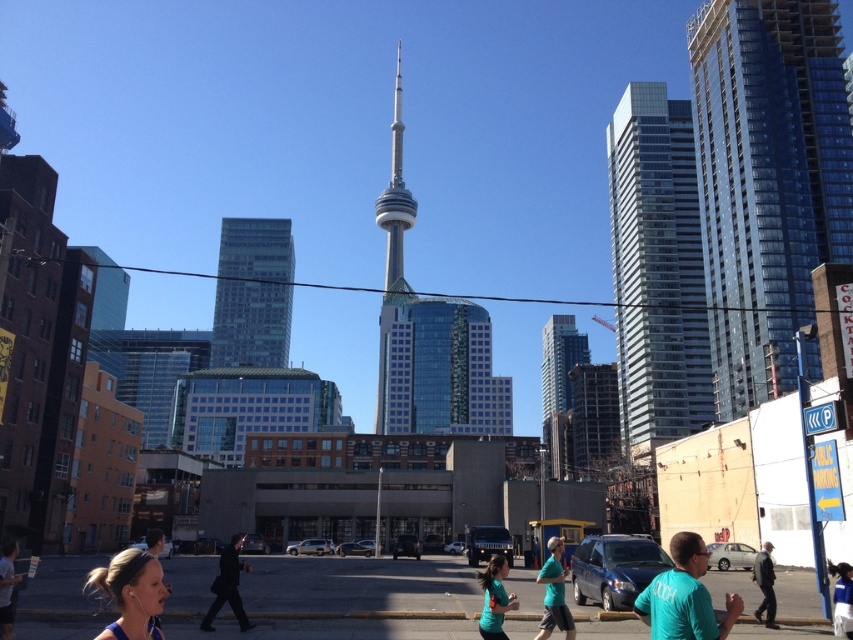
You are standing on the street and looking at two points marked in the image. The first point is at coordinate point (549, 566) and the second is at point (496, 561). Which point is closer to you?

Point (496, 561) is closer to you because it is less further to the camera than point (549, 566).

You are a city planner reviewing the urban layout. You need to determine if the glassy blue skyscraper at right would block sunlight to the dark gray pants at center. Based on their heights, can you conclude this?

The glassy blue skyscraper at right is taller than dark gray pants at center, so it could potentially block sunlight depending on their exact positions and angles, but height alone doesn